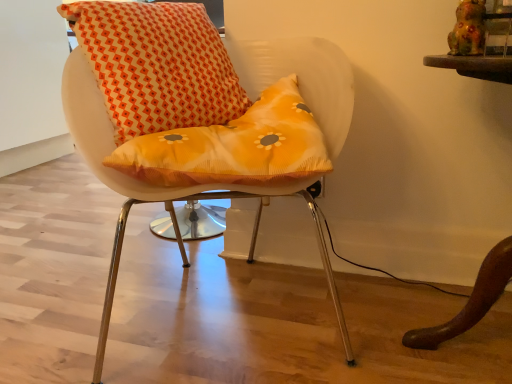
Where is `orange printed cushion at center`? The image size is (512, 384). orange printed cushion at center is located at coordinates (200, 104).

What do you see at coordinates (200, 104) in the screenshot?
I see `orange printed cushion at center` at bounding box center [200, 104].

Locate an element on the screen. matte white chair at center is located at coordinates (198, 118).

This screenshot has width=512, height=384. What do you see at coordinates (198, 118) in the screenshot? I see `matte white chair at center` at bounding box center [198, 118].

Locate an element on the screen. The width and height of the screenshot is (512, 384). orange printed cushion at center is located at coordinates (x=200, y=104).

Considering the relative positions of orange printed cushion at center and matte white chair at center in the image provided, is orange printed cushion at center to the left of matte white chair at center from the viewer's perspective?

Yes.

Which object is closer to the camera taking this photo, orange printed cushion at center or matte white chair at center?

matte white chair at center is more forward.

Does point (159, 180) appear closer or farther from the camera than point (164, 152)?

Point (159, 180).

From the image's perspective, which is above, orange printed cushion at center or matte white chair at center?

orange printed cushion at center, from the image's perspective.

From a real-world perspective, is orange printed cushion at center located beneath matte white chair at center?

No, from a real-world perspective, orange printed cushion at center is not under matte white chair at center.

Considering the sizes of orange printed cushion at center and matte white chair at center in the image, is orange printed cushion at center wider or thinner than matte white chair at center?

Clearly, orange printed cushion at center has less width compared to matte white chair at center.

Does orange printed cushion at center have a lesser height compared to matte white chair at center?

Yes.

Considering the sizes of objects orange printed cushion at center and matte white chair at center in the image provided, who is smaller, orange printed cushion at center or matte white chair at center?

orange printed cushion at center.

Is orange printed cushion at center not inside matte white chair at center?

No.

Is orange printed cushion at center placed right next to matte white chair at center?

Yes, orange printed cushion at center is beside matte white chair at center.

Is orange printed cushion at center turned away from matte white chair at center?

Yes, orange printed cushion at center is facing away from matte white chair at center.

How many degrees apart are the facing directions of orange printed cushion at center and matte white chair at center?

33 degrees separate the facing orientations of orange printed cushion at center and matte white chair at center.

Locate an element on the screen. Image resolution: width=512 pixels, height=384 pixels. bean bag chair above the matte white chair at center (from the image's perspective) is located at coordinates (200, 104).

Would you say matte white chair at center is to the left or to the right of orange printed cushion at center in the picture?

Based on their positions, matte white chair at center is located to the right of orange printed cushion at center.

Considering the positions of objects matte white chair at center and orange printed cushion at center in the image provided, who is behind, matte white chair at center or orange printed cushion at center?

orange printed cushion at center is more distant.

Between point (325, 64) and point (162, 72), which one is positioned in front?

Point (162, 72)

From the image's perspective, is matte white chair at center on top of orange printed cushion at center?

No.

In the scene shown: From a real-world perspective, is matte white chair at center beneath orange printed cushion at center?

Correct, in the physical world, matte white chair at center is lower than orange printed cushion at center.

Does matte white chair at center have a lesser width compared to orange printed cushion at center?

No.

From the picture: Considering the sizes of matte white chair at center and orange printed cushion at center in the image, is matte white chair at center taller or shorter than orange printed cushion at center?

Considering their sizes, matte white chair at center has more height than orange printed cushion at center.

Based on their sizes in the image, would you say matte white chair at center is bigger or smaller than orange printed cushion at center?

Considering their sizes, matte white chair at center takes up more space than orange printed cushion at center.

Is matte white chair at center not inside orange printed cushion at center?

matte white chair at center lies outside orange printed cushion at center's area.

Is matte white chair at center touching orange printed cushion at center?

Yes, matte white chair at center is right next to orange printed cushion at center and making contact.

Could you tell me if matte white chair at center is turned towards orange printed cushion at center?

No, matte white chair at center does not turn towards orange printed cushion at center.

How many degrees apart are the facing directions of matte white chair at center and orange printed cushion at center?

The facing directions of matte white chair at center and orange printed cushion at center are 33 degrees apart.

At what (x,y) coordinates should I click in order to perform the action: click on bean bag chair on the left of matte white chair at center. Please return your answer as a coordinate pair (x, y). The image size is (512, 384). Looking at the image, I should click on (200, 104).

Find the location of a particular element. This screenshot has width=512, height=384. bean bag chair above the matte white chair at center (from the image's perspective) is located at coordinates (200, 104).

I want to click on chair below the orange printed cushion at center (from a real-world perspective), so click(198, 118).